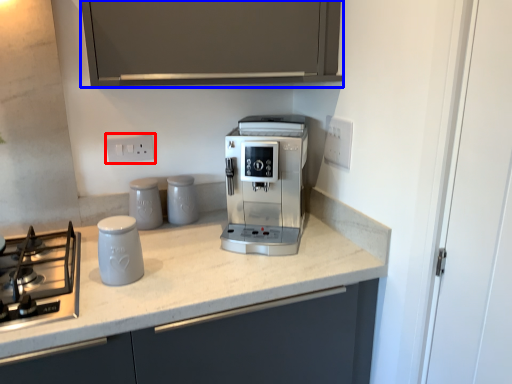
Question: Which of the following is the farthest to the observer, electric outlet (highlighted by a red box) or cabinetry (highlighted by a blue box)?

Choices:
 (A) electric outlet
 (B) cabinetry

Answer: (A)